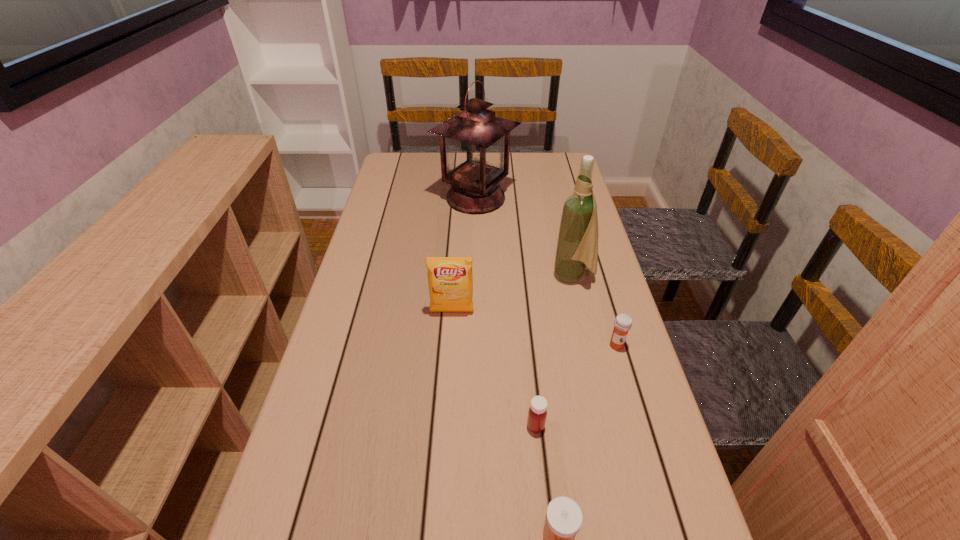
Image resolution: width=960 pixels, height=540 pixels. Identify the location of vacant space positioned 0.260m on the front-facing side of the wine bottle. (461, 276).

The width and height of the screenshot is (960, 540). What are the coordinates of `vacant space situated on the front of the fourth shortest object with the logo` in the screenshot? It's located at (450, 335).

Find the location of a particular element. The height and width of the screenshot is (540, 960). free location located 0.210m on the label side of the farthest medicine is located at coordinates pos(642,434).

Find the location of `vacant space positioned 0.390m on the back of the second nearest medicine`. vacant space positioned 0.390m on the back of the second nearest medicine is located at coordinates (521, 289).

Identify the location of object that is at the far edge. (474, 144).

Identify the location of wine bottle at the right edge. This screenshot has width=960, height=540. (577, 246).

The height and width of the screenshot is (540, 960). Find the location of `medicine that is at the right edge`. medicine that is at the right edge is located at coordinates [x=623, y=322].

This screenshot has height=540, width=960. What are the coordinates of `free region at the left edge` in the screenshot? It's located at pos(365,457).

The height and width of the screenshot is (540, 960). In the image, there is a desktop. What are the coordinates of `vacant space at the right edge` in the screenshot? It's located at (629, 530).

The height and width of the screenshot is (540, 960). In the image, there is a desktop. Find the location of `free space at the far left corner`. free space at the far left corner is located at coordinates (399, 160).